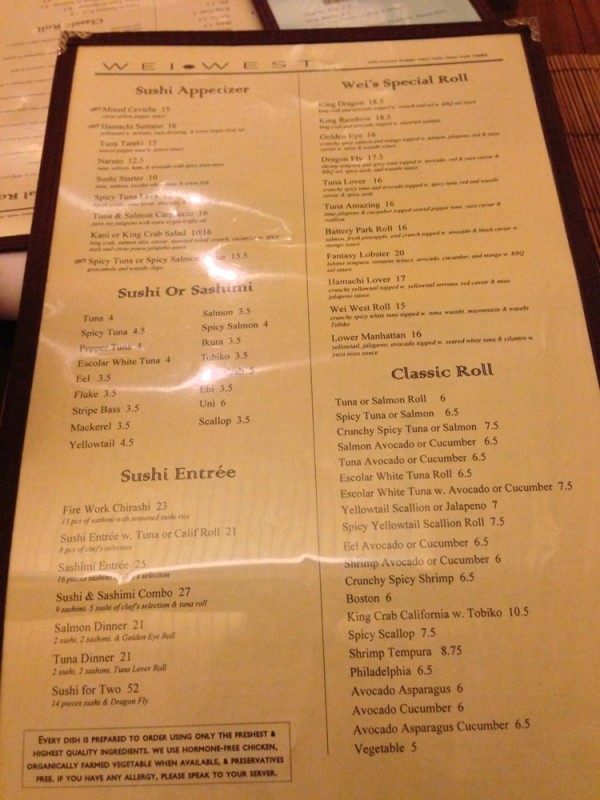
Image resolution: width=600 pixels, height=800 pixels. What are the coordinates of `table` in the screenshot? It's located at (553, 26), (14, 397).